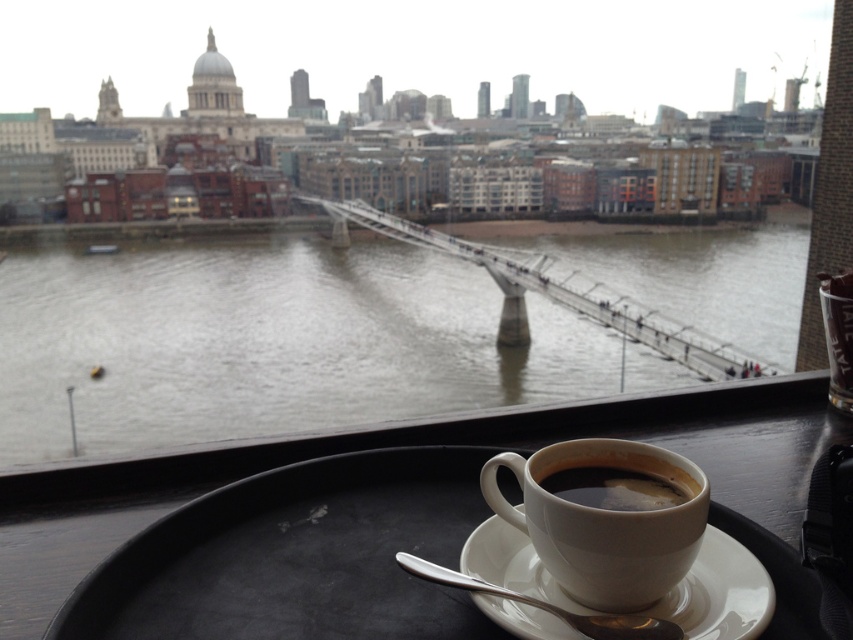
Question: Which of the following is the farthest from the observer?

Choices:
 (A) (805, 442)
 (B) (206, 410)
 (C) (677, 600)
 (D) (622, 604)

Answer: (B)

Question: Does brown water at center appear on the right side of black matte cup at center?

Choices:
 (A) yes
 (B) no

Answer: (B)

Question: Which point is closer to the camera?

Choices:
 (A) (474, 376)
 (B) (653, 584)
 (C) (735, 576)
 (D) (595, 468)

Answer: (B)

Question: Does black matte tray at lower center have a greater width compared to white ceramic cup at center?

Choices:
 (A) yes
 (B) no

Answer: (A)

Question: Which object appears closest to the camera in this image?

Choices:
 (A) white ceramic cup at center
 (B) black matte cup at center
 (C) white ceramic saucer at lower center

Answer: (A)

Question: From the image, what is the correct spatial relationship of brown water at center in relation to black matte cup at center?

Choices:
 (A) below
 (B) above

Answer: (B)